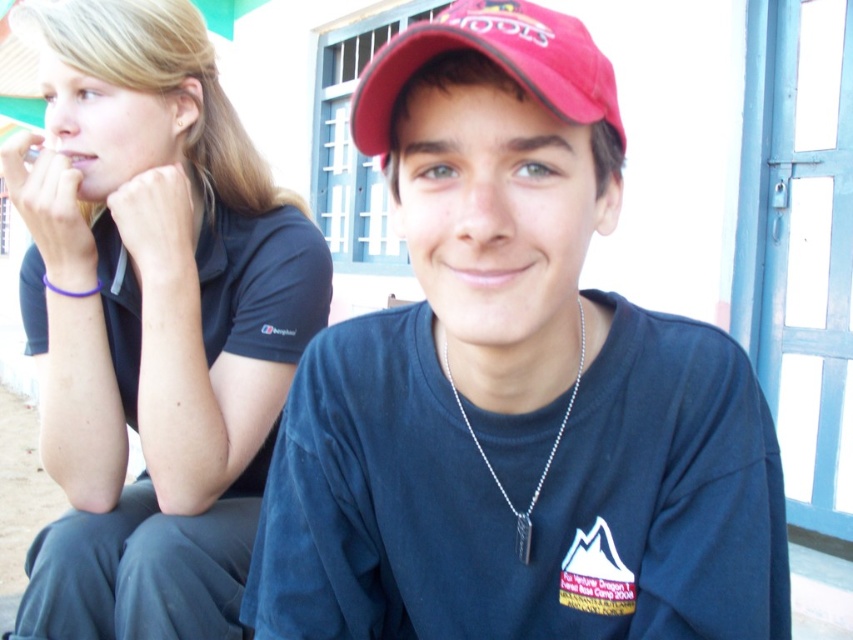
Between matte black shirt at center and black matte shirt at upper left, which one is positioned higher?

black matte shirt at upper left

Is matte black shirt at center positioned before black matte shirt at upper left?

Yes, it is in front of black matte shirt at upper left.

Identify the location of matte black shirt at center. (514, 387).

Can you confirm if matte black shirt at center is bigger than silver chain at center?

Indeed, matte black shirt at center has a larger size compared to silver chain at center.

Who is lower down, matte black shirt at center or silver chain at center?

matte black shirt at center

This screenshot has width=853, height=640. What are the coordinates of `matte black shirt at center` in the screenshot? It's located at (514, 387).

Is point (570, 74) farther from viewer compared to point (581, 323)?

No, it is not.

At what (x,y) coordinates should I click in order to perform the action: click on matte red baseball cap at center. Please return your answer as a coordinate pair (x, y). The image size is (853, 640). Looking at the image, I should click on (492, 61).

In order to click on matte red baseball cap at center in this screenshot , I will do `click(492, 61)`.